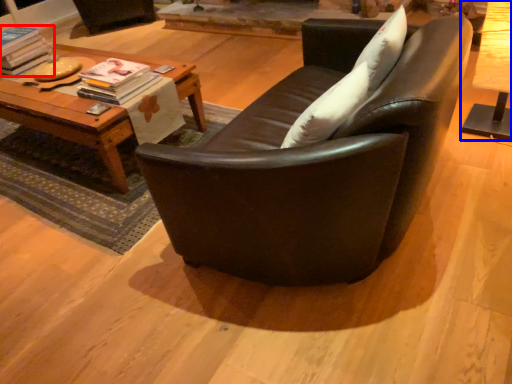
Question: Among these objects, which one is nearest to the camera, magazine (highlighted by a red box) or table (highlighted by a blue box)?

Choices:
 (A) magazine
 (B) table

Answer: (B)